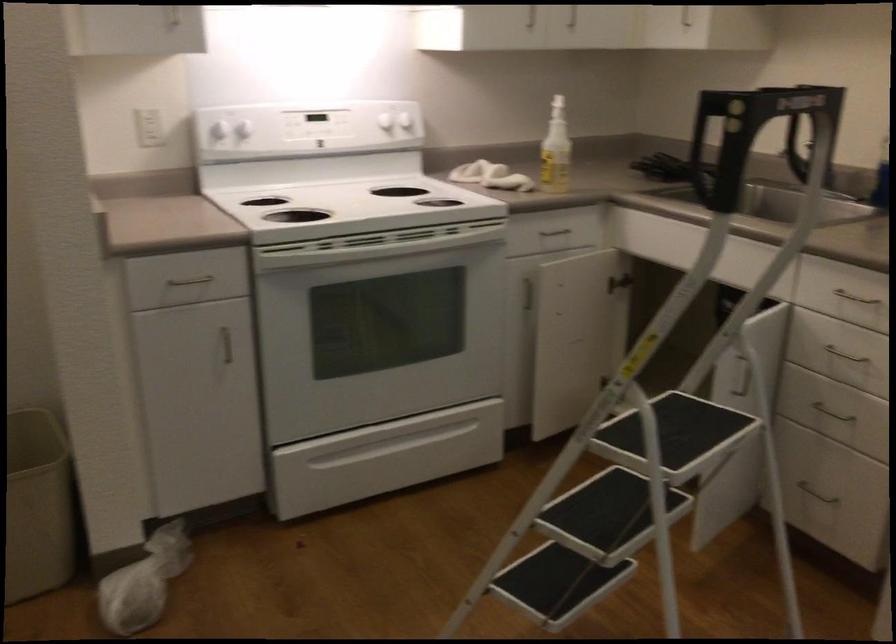
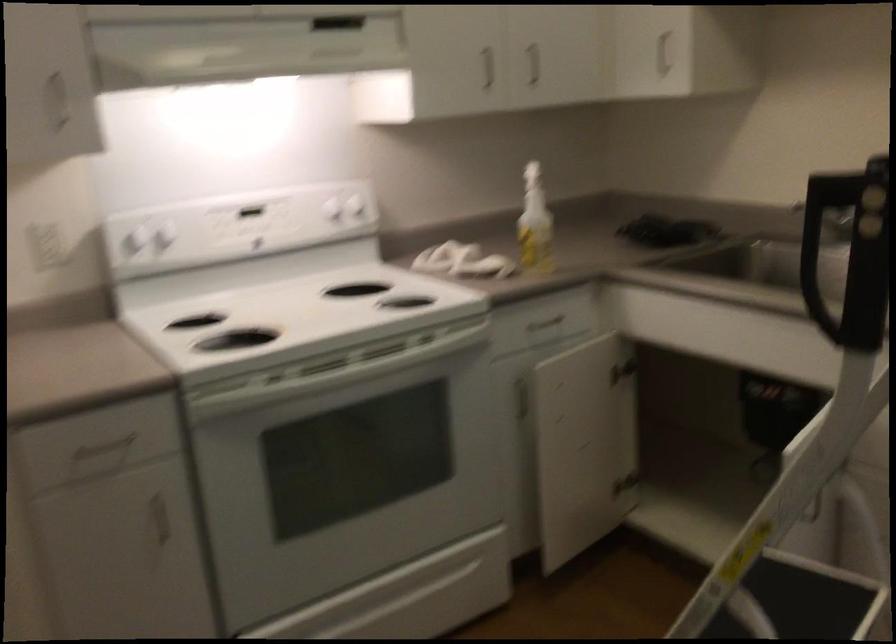
The point at (186, 281) is marked in the first image. Where is the corresponding point in the second image?

(102, 448)